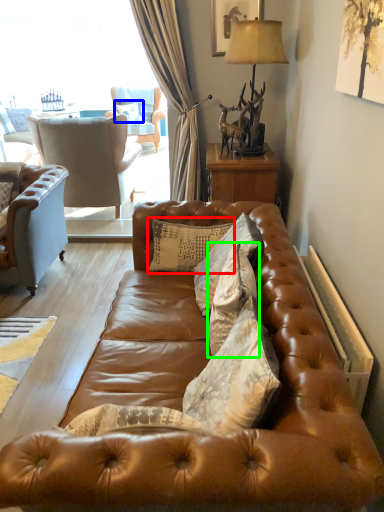
Question: Which object is the farthest from pillow (highlighted by a red box)? Choose among these: pillow (highlighted by a blue box) or pillow (highlighted by a green box).

Choices:
 (A) pillow
 (B) pillow

Answer: (A)